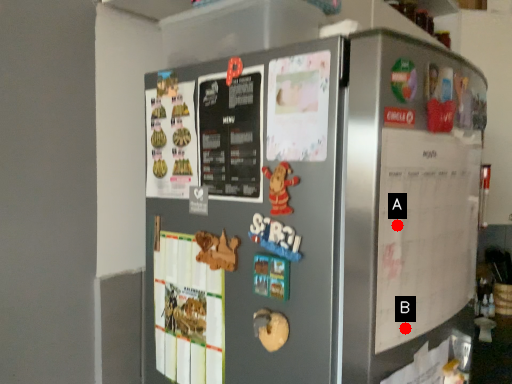
Question: Two points are circled on the image, labeled by A and B beside each circle. Which point is further to the camera?

Choices:
 (A) A is further
 (B) B is further

Answer: (B)